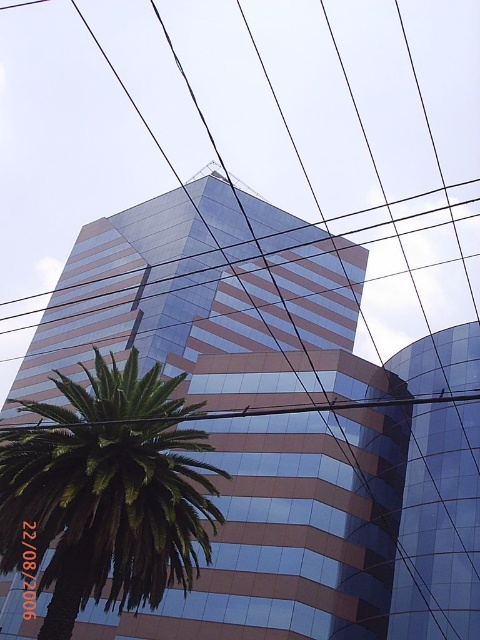
Does glassy reflective building at center appear under green leafy palm at lower left?

Incorrect, glassy reflective building at center is not positioned below green leafy palm at lower left.

Can you confirm if glassy reflective building at center is positioned to the left of green leafy palm at lower left?

Yes, glassy reflective building at center is to the left of green leafy palm at lower left.

Between point (425, 340) and point (163, 468), which one is positioned in front?

Point (163, 468)

I want to click on glassy reflective building at center, so click(282, 420).